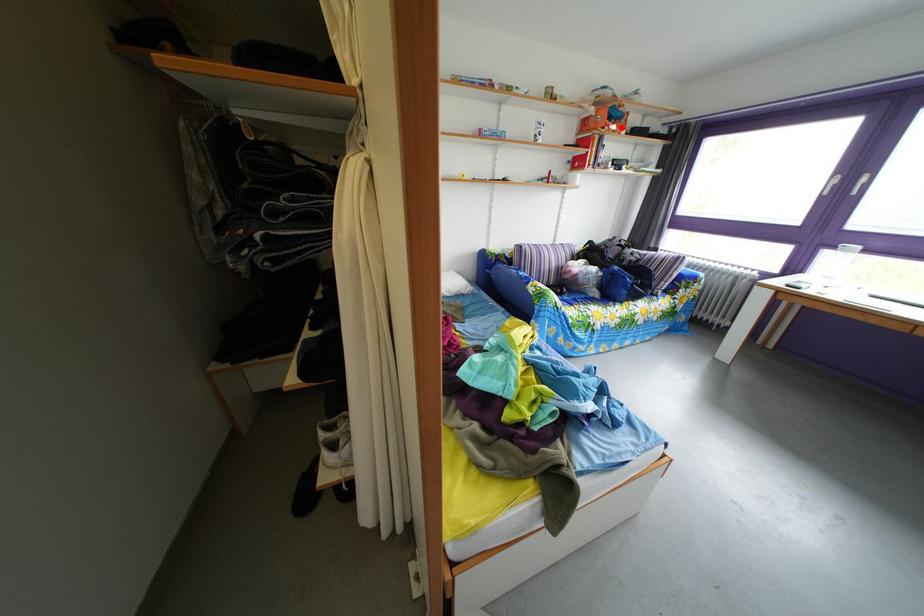
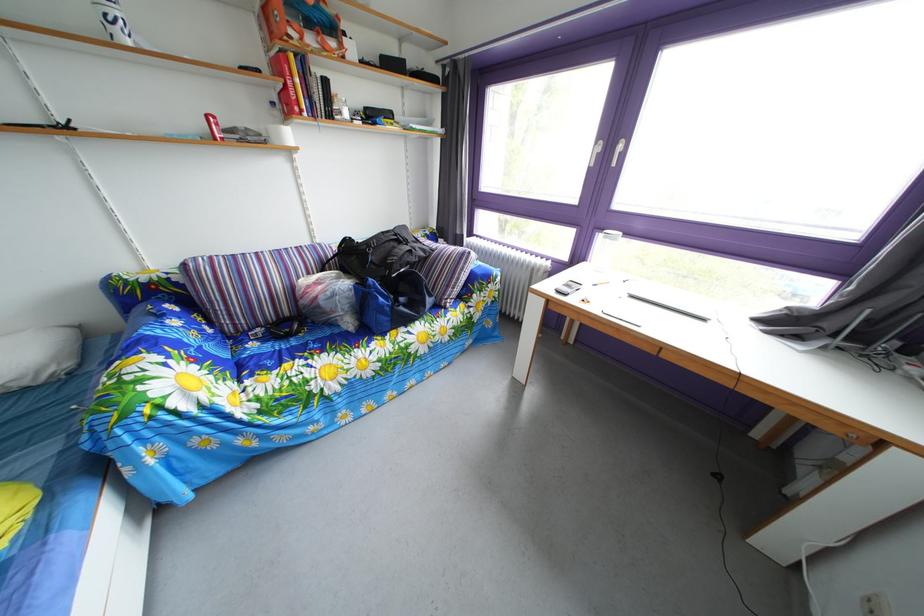
Where in the second image is the point corresponding to the highlighted location from the first image?

(320, 33)